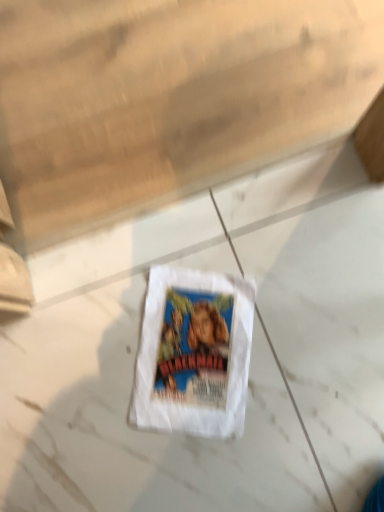
This screenshot has width=384, height=512. Describe the element at coordinates (193, 353) in the screenshot. I see `white paper grocery bag at center` at that location.

Measure the distance between point (207, 382) and camera.

The depth of point (207, 382) is 31.46 inches.

What are the coordinates of `white paper grocery bag at center` in the screenshot? It's located at (193, 353).

At what (x,y) coordinates should I click in order to perform the action: click on white paper grocery bag at center. Please return your answer as a coordinate pair (x, y). This screenshot has width=384, height=512. Looking at the image, I should click on (193, 353).